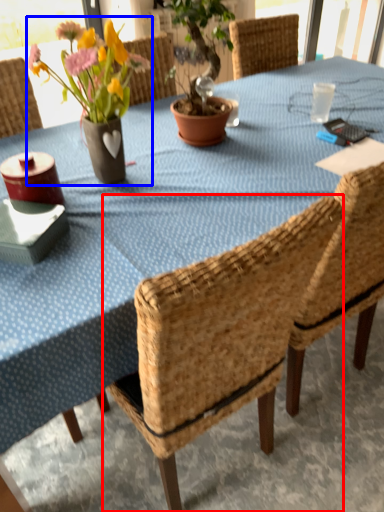
Question: Which point is closer to the camera, chair (highlighted by a red box) or floral arrangement (highlighted by a blue box)?

Choices:
 (A) chair
 (B) floral arrangement

Answer: (A)